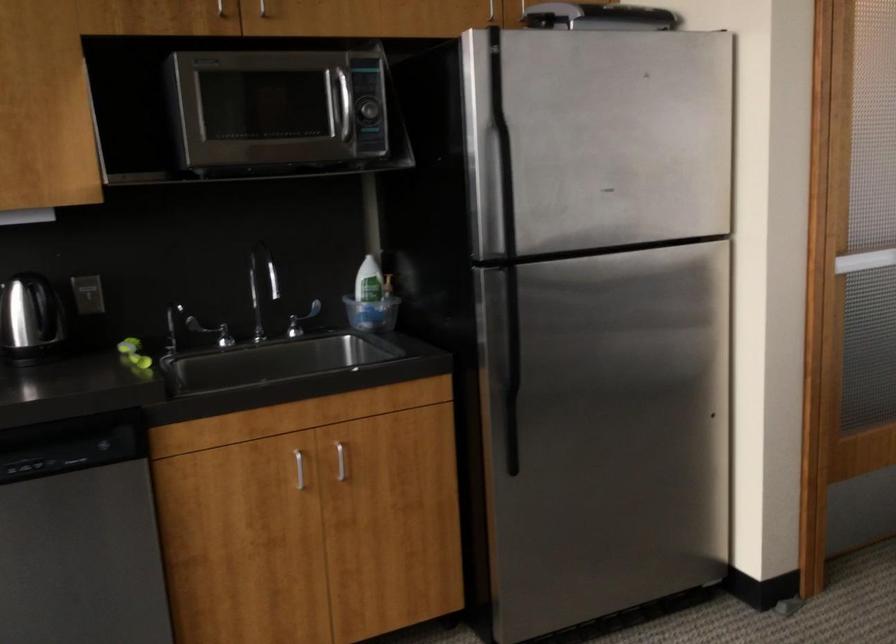
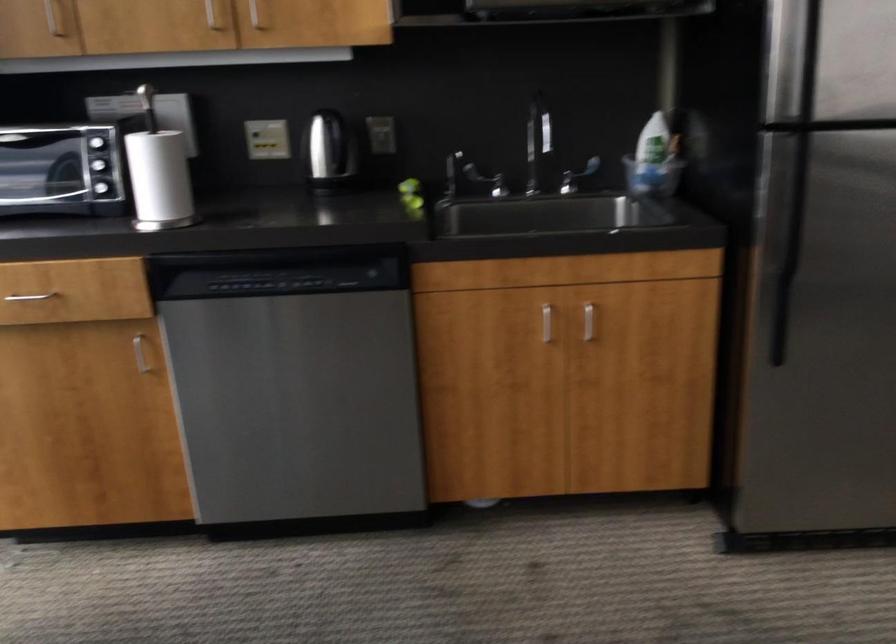
Locate, in the second image, the point that corresponds to pixel 296 321 in the first image.

(576, 176)